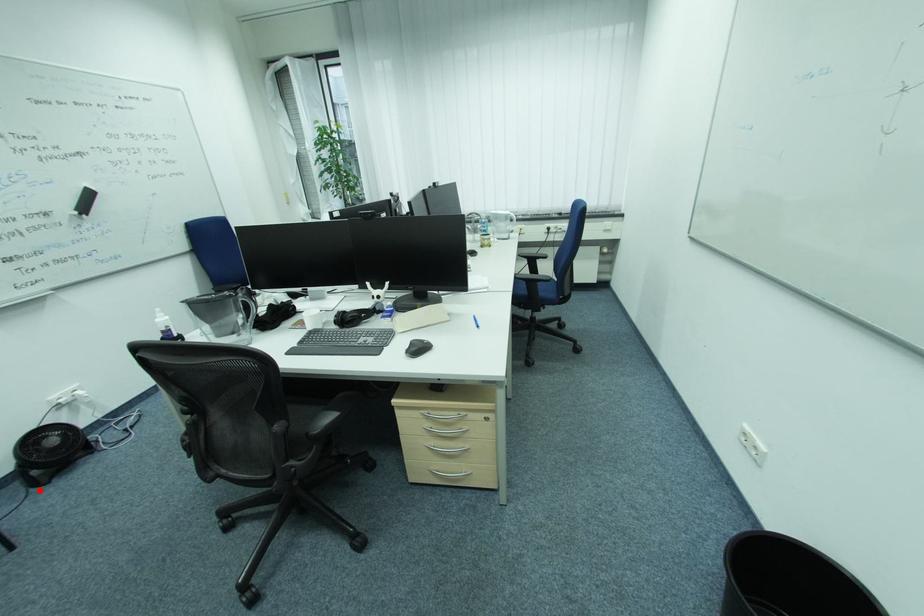
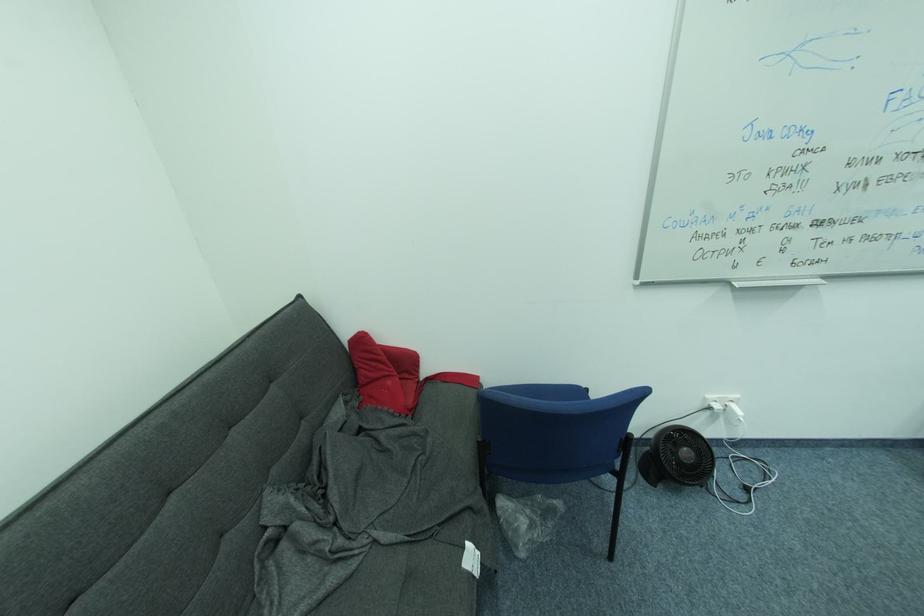
Question: I am providing you with two images of the same scene from different viewpoints. Given a red point in image1, look at the same physical point in image2. Is it:

Choices:
 (A) Closer to the viewpoint
 (B) Farther from the viewpoint

Answer: (A)